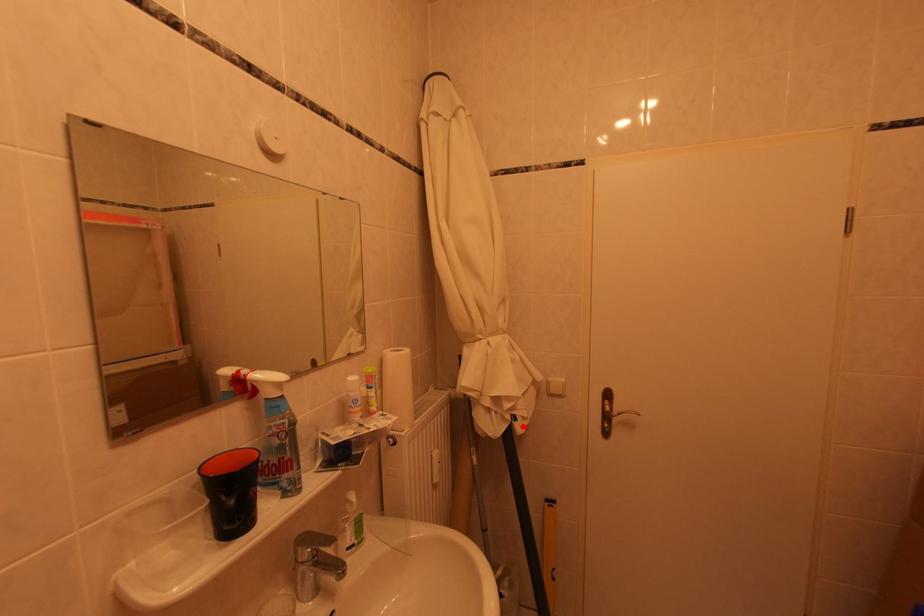
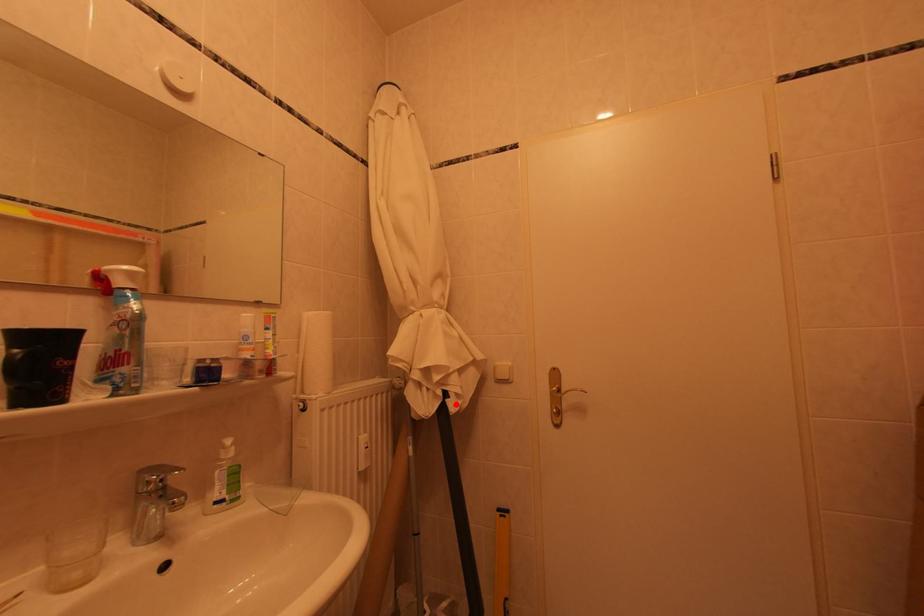
I am providing you with two images of the same scene from different viewpoints. A red point is marked on the first image and another point is marked on the second image. Is the marked point in image1 the same physical position as the marked point in image2?

Yes